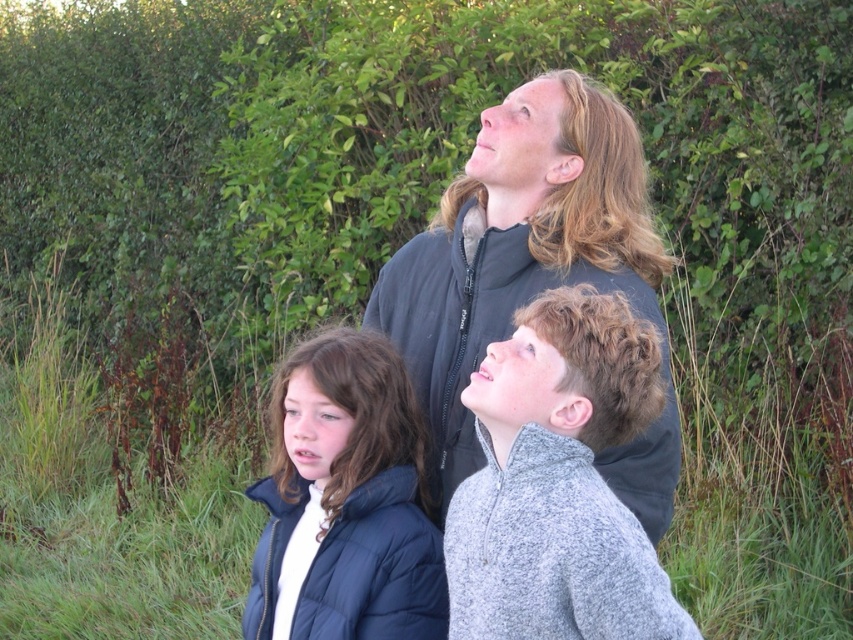
Question: Does green grass at center lie behind matte blue puffer jacket at lower left?

Choices:
 (A) no
 (B) yes

Answer: (B)

Question: Among these points, which one is nearest to the camera?

Choices:
 (A) (639, 412)
 (B) (370, 545)
 (C) (175, 534)

Answer: (A)

Question: Can you confirm if dark gray jacket at center is positioned above matte blue puffer jacket at lower left?

Choices:
 (A) no
 (B) yes

Answer: (B)

Question: Which point is farther to the camera?

Choices:
 (A) (364, 467)
 (B) (621, 268)
 (C) (228, 467)
 (D) (598, 406)

Answer: (C)

Question: Does dark gray jacket at center have a lesser width compared to matte blue puffer jacket at lower left?

Choices:
 (A) no
 (B) yes

Answer: (A)

Question: Which of the following is the farthest from the observer?

Choices:
 (A) (769, 419)
 (B) (358, 353)
 (C) (434, 452)
 (D) (607, 435)

Answer: (A)